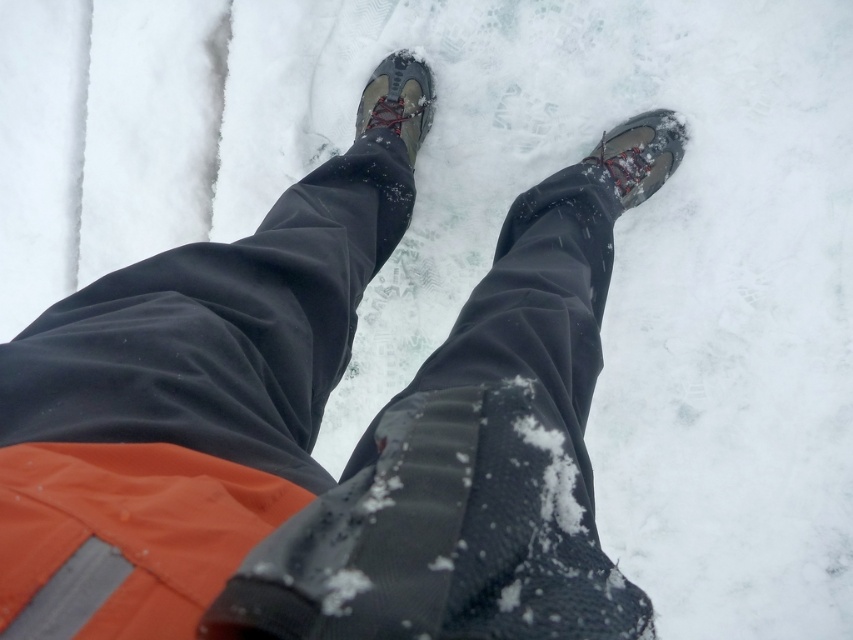
You are trying to determine the direction of the path ahead based on the placement of the boots. Which boot, the matte gray boot at lower right or the matte gray boot at center, is more to the right?

The matte gray boot at lower right is positioned on the right side of the matte gray boot at center, so the matte gray boot at lower right is more to the right.

You are a photographer trying to capture the best angle of the matte gray boot at lower right and the matte gray boot at center. Since you want to focus on the boot with the shorter height, which boot should you concentrate your camera on?

The matte gray boot at lower right has a lesser height compared to the matte gray boot at center, so you should concentrate your camera on the matte gray boot at lower right.